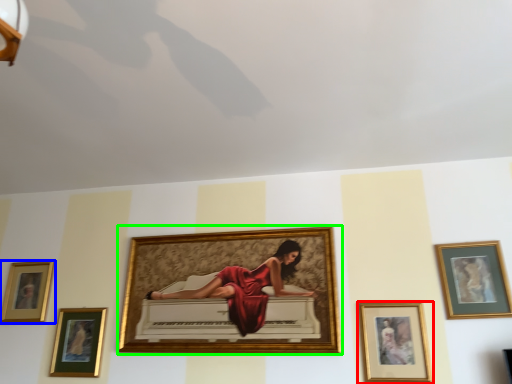
Question: Based on their relative distances, which object is farther from picture frame (highlighted by a red box)? Choose from picture frame (highlighted by a blue box) and picture frame (highlighted by a green box).

Choices:
 (A) picture frame
 (B) picture frame

Answer: (A)